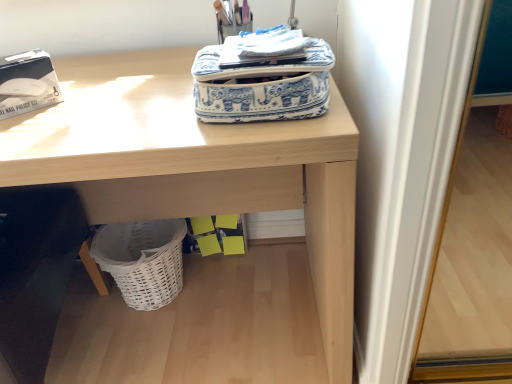
Question: Is white wicker basket at lower left turned away from wooden desk at upper center?

Choices:
 (A) no
 (B) yes

Answer: (B)

Question: Is white wicker basket at lower left positioned behind wooden desk at upper center?

Choices:
 (A) yes
 (B) no

Answer: (A)

Question: From the image's perspective, is white wicker basket at lower left under wooden desk at upper center?

Choices:
 (A) no
 (B) yes

Answer: (B)

Question: Is white wicker basket at lower left shorter than wooden desk at upper center?

Choices:
 (A) no
 (B) yes

Answer: (B)

Question: From a real-world perspective, is white wicker basket at lower left over wooden desk at upper center?

Choices:
 (A) no
 (B) yes

Answer: (A)

Question: Considering the relative sizes of white wicker basket at lower left and wooden desk at upper center in the image provided, is white wicker basket at lower left thinner than wooden desk at upper center?

Choices:
 (A) no
 (B) yes

Answer: (B)

Question: Is white wicker basket at lower left in front of blue and white fabric bag at upper center?

Choices:
 (A) no
 (B) yes

Answer: (A)

Question: Can you confirm if white wicker basket at lower left is bigger than blue and white fabric bag at upper center?

Choices:
 (A) no
 (B) yes

Answer: (B)

Question: Could you tell me if white wicker basket at lower left is turned towards blue and white fabric bag at upper center?

Choices:
 (A) no
 (B) yes

Answer: (A)

Question: Does white wicker basket at lower left touch blue and white fabric bag at upper center?

Choices:
 (A) yes
 (B) no

Answer: (B)

Question: Is white wicker basket at lower left surrounding blue and white fabric bag at upper center?

Choices:
 (A) yes
 (B) no

Answer: (B)

Question: Can you confirm if white wicker basket at lower left is wider than blue and white fabric bag at upper center?

Choices:
 (A) yes
 (B) no

Answer: (A)

Question: Considering the relative positions of wooden desk at upper center and white wicker basket at lower left in the image provided, is wooden desk at upper center to the right of white wicker basket at lower left from the viewer's perspective?

Choices:
 (A) no
 (B) yes

Answer: (A)